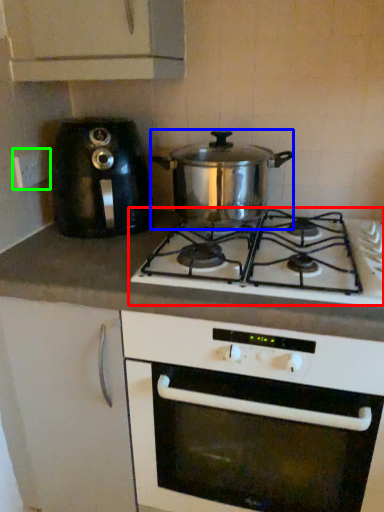
Question: Considering the real-world distances, which object is farthest from gas stove (highlighted by a red box)? kitchen appliance (highlighted by a blue box) or electric outlet (highlighted by a green box)?

Choices:
 (A) kitchen appliance
 (B) electric outlet

Answer: (B)